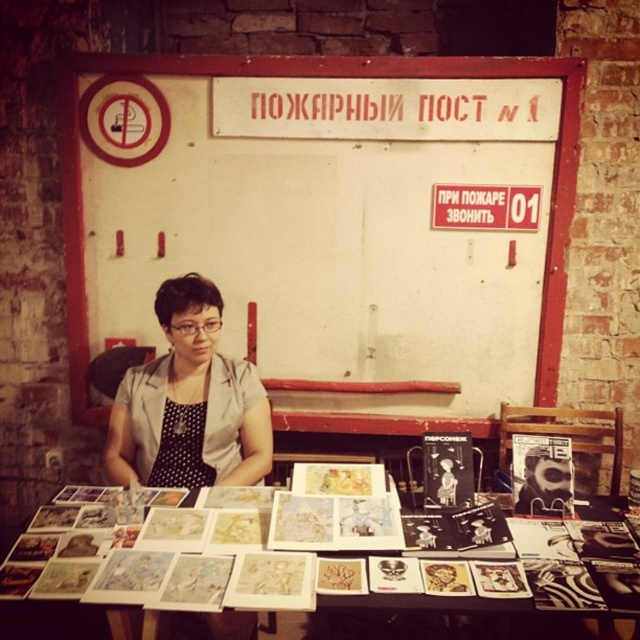
Question: Is white matte board at upper center to the left of gray dotted dress at center from the viewer's perspective?

Choices:
 (A) yes
 (B) no

Answer: (B)

Question: Among these points, which one is farthest from the camera?

Choices:
 (A) (164, 444)
 (B) (253, 381)

Answer: (B)

Question: Which object is positioned farthest from the gray dotted dress at center?

Choices:
 (A) white matte board at upper center
 (B) white paper at center

Answer: (B)

Question: Which of the following is the closest to the observer?

Choices:
 (A) (548, 305)
 (B) (192, 620)
 (C) (200, 440)
 (D) (246, 372)

Answer: (B)

Question: Can you confirm if white matte board at upper center is bigger than white paper at center?

Choices:
 (A) no
 (B) yes

Answer: (B)

Question: Can you confirm if white matte board at upper center is thinner than white paper at center?

Choices:
 (A) no
 (B) yes

Answer: (A)